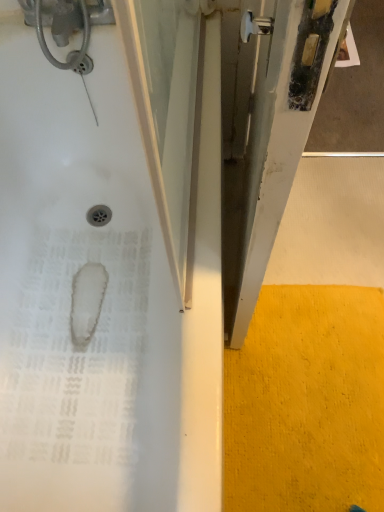
Find the location of a particular element. The height and width of the screenshot is (512, 384). vacant area on the back side of yellow textured carpet at lower right is located at coordinates (326, 233).